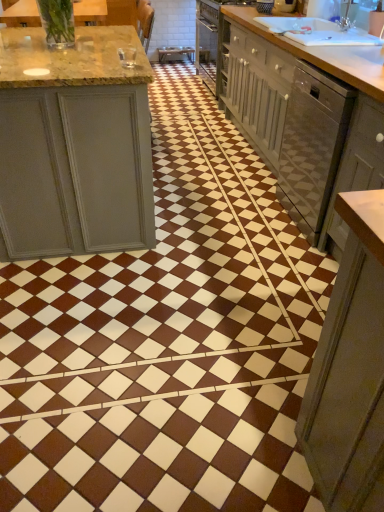
You are a GUI agent. You are given a task and a screenshot of the screen. Output one action in this format:
    pyautogui.click(x=<x>, y=<y>)
    Task: Click on the free space in front of light brown wood countertop at upper right, acting as the 2th countertop starting from the left
    This screenshot has height=512, width=384.
    Given the screenshot: What is the action you would take?
    (233, 208)